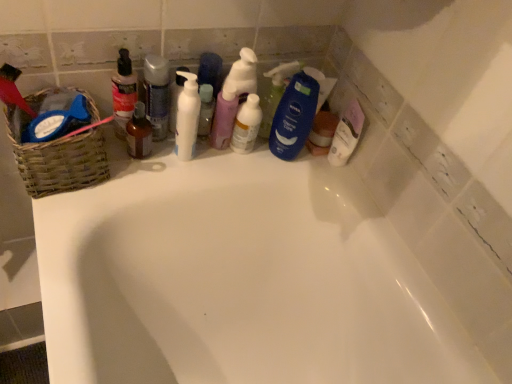
The height and width of the screenshot is (384, 512). In order to click on vacant region in front of translucent plastic spray bottle at center, which is counted as the third cleaning product, starting from the left in this screenshot , I will do `click(207, 167)`.